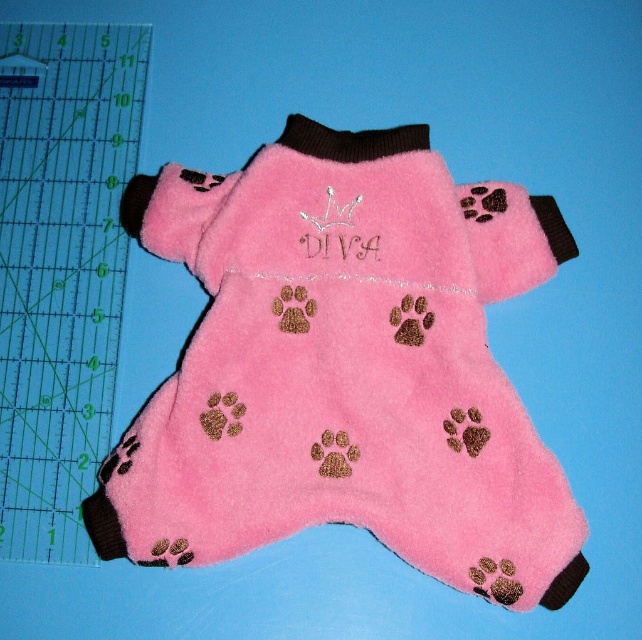
You are a small dog wearing a pink fleece dog coat at center. Your owner is holding a treat 1 meter away from you. Can you reach the treat without moving your body?

The pink fleece dog coat at center and viewer are 1.26 meters apart from each other. Since the treat is only 1 meter away, you can reach it without moving your body because the distance to the treat is shorter than the distance between you and the viewer.

You need to determine if the pink fleece dog coat at center can fit inside a storage box that is the same size as the transparent plastic ruler at left. Based on the scene, can it fit?

The pink fleece dog coat at center is larger than the transparent plastic ruler at left, so it cannot fit inside a storage box that is the same size as the ruler.

You are holding a transparent plastic ruler at left and want to measure the distance between it and the pink fleece dog coat at center. Can you reach the ruler to touch the coat?

The pink fleece dog coat at center is closer to the viewer than the transparent plastic ruler at left, so you can reach the ruler to touch the coat.